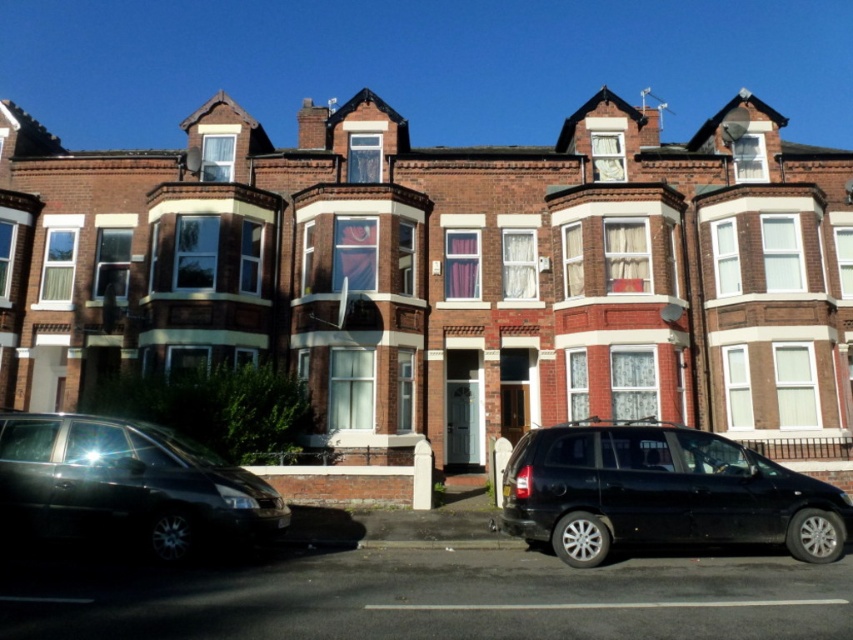
Question: Which of the following is the closest to the observer?

Choices:
 (A) (521, 500)
 (B) (212, 458)

Answer: (A)

Question: Does black matte van at center lie in front of shiny black car at lower left?

Choices:
 (A) no
 (B) yes

Answer: (A)

Question: Can you confirm if black matte van at center is wider than shiny black car at lower left?

Choices:
 (A) no
 (B) yes

Answer: (B)

Question: Among these objects, which one is farthest from the camera?

Choices:
 (A) black matte van at center
 (B) shiny black car at lower left

Answer: (A)

Question: Can you confirm if black matte van at center is positioned to the left of shiny black car at lower left?

Choices:
 (A) yes
 (B) no

Answer: (B)

Question: Among these points, which one is nearest to the camera?

Choices:
 (A) (76, 433)
 (B) (828, 518)

Answer: (B)